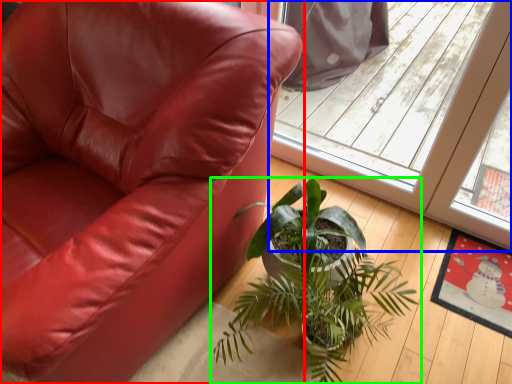
Question: Which object is the farthest from chair (highlighted by a red box)? Choose among these: screen door (highlighted by a blue box) or houseplant (highlighted by a green box).

Choices:
 (A) screen door
 (B) houseplant

Answer: (A)